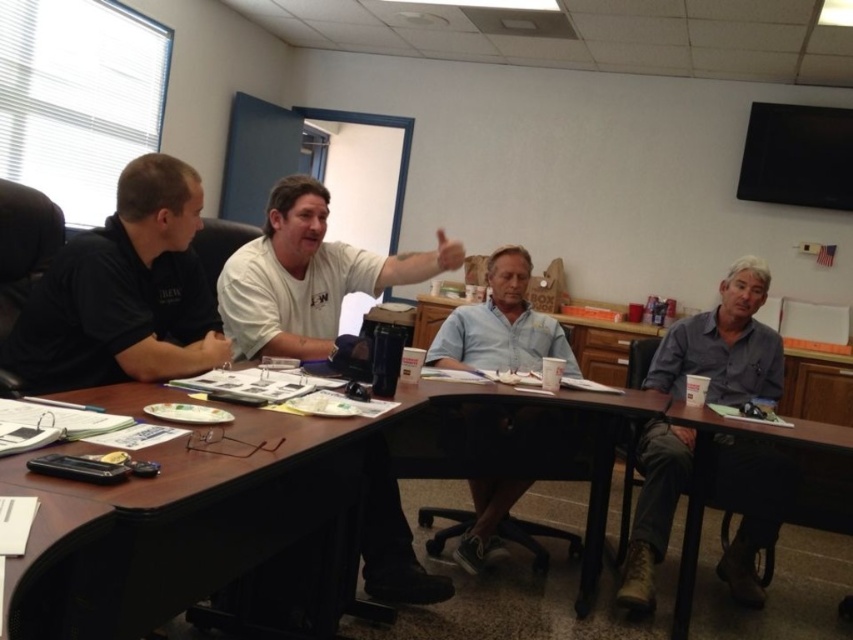
Based on the photo, is black shirt at left smaller than light blue shirt at center?

Yes.

Is black shirt at left shorter than light blue shirt at center?

In fact, black shirt at left may be taller than light blue shirt at center.

Image resolution: width=853 pixels, height=640 pixels. What are the coordinates of `black shirt at left` in the screenshot? It's located at (123, 292).

At what (x,y) coordinates should I click in order to perform the action: click on black shirt at left. Please return your answer as a coordinate pair (x, y). Looking at the image, I should click on (123, 292).

Does white cotton shirt at center appear on the left side of gray fabric shirt at right?

Yes, white cotton shirt at center is to the left of gray fabric shirt at right.

Which is behind, point (241, 300) or point (709, 321)?

Positioned behind is point (709, 321).

I want to click on white cotton shirt at center, so click(306, 276).

Between point (701, 348) and point (482, 307), which one is positioned in front?

Point (701, 348) is more forward.

You are a GUI agent. You are given a task and a screenshot of the screen. Output one action in this format:
    pyautogui.click(x=<x>, y=<y>)
    Task: Click on the gray fabric shirt at right
    
    Given the screenshot: What is the action you would take?
    pyautogui.click(x=723, y=344)